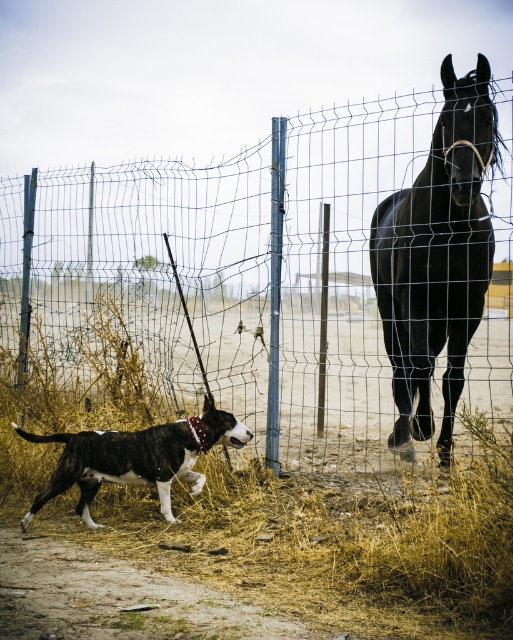
Is wire mesh fence at center to the right of black glossy horse at right from the viewer's perspective?

No, wire mesh fence at center is not to the right of black glossy horse at right.

Describe the element at coordinates (299, 273) in the screenshot. This screenshot has width=513, height=640. I see `wire mesh fence at center` at that location.

Does point (121, 198) come closer to viewer compared to point (452, 138)?

No, (121, 198) is behind (452, 138).

Locate an element on the screen. Image resolution: width=513 pixels, height=640 pixels. wire mesh fence at center is located at coordinates (299, 273).

Can you confirm if black glossy horse at right is bigger than black-and-white fur dog at lower left?

Indeed, black glossy horse at right has a larger size compared to black-and-white fur dog at lower left.

Is black glossy horse at right smaller than black-and-white fur dog at lower left?

No, black glossy horse at right is not smaller than black-and-white fur dog at lower left.

Which is behind, point (457, 353) or point (233, 429)?

The point (457, 353) is behind.

Locate an element on the screen. Image resolution: width=513 pixels, height=640 pixels. black glossy horse at right is located at coordinates (437, 257).

Can you confirm if wire mesh fence at center is taller than brown dry grass at lower left?

Correct, wire mesh fence at center is much taller as brown dry grass at lower left.

Does wire mesh fence at center appear on the right side of brown dry grass at lower left?

Indeed, wire mesh fence at center is positioned on the right side of brown dry grass at lower left.

Where is `wire mesh fence at center`? The image size is (513, 640). wire mesh fence at center is located at coordinates (299, 273).